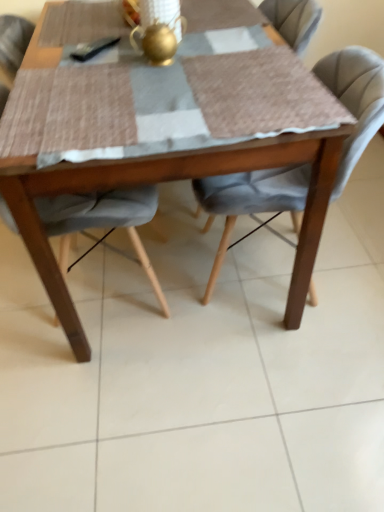
What are the coordinates of `vacant space to the right of gold metallic teapot at center` in the screenshot? It's located at point(223,60).